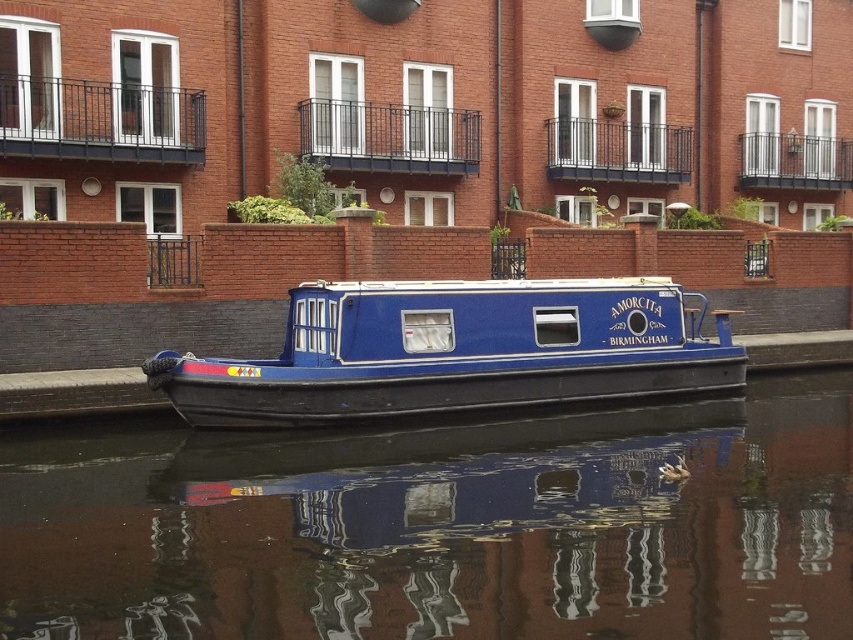
Who is more forward, (757, 412) or (479, 305)?

Point (479, 305)

Does glossy blue water at center appear under blue polished wood barge at center?

Yes.

Describe the element at coordinates (440, 525) in the screenshot. I see `glossy blue water at center` at that location.

The image size is (853, 640). Find the location of `glossy blue water at center`. glossy blue water at center is located at coordinates (440, 525).